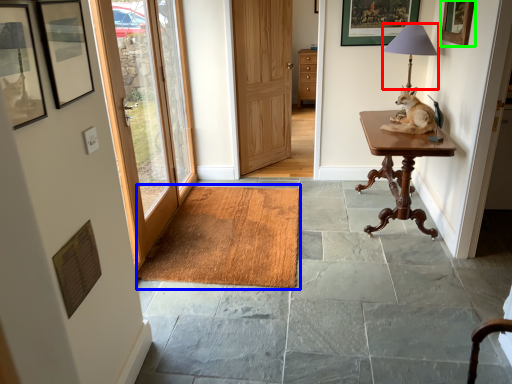
Question: Which object is the farthest from table lamp (highlighted by a red box)? Choose among these: doormat (highlighted by a blue box) or picture frame (highlighted by a green box).

Choices:
 (A) doormat
 (B) picture frame

Answer: (A)